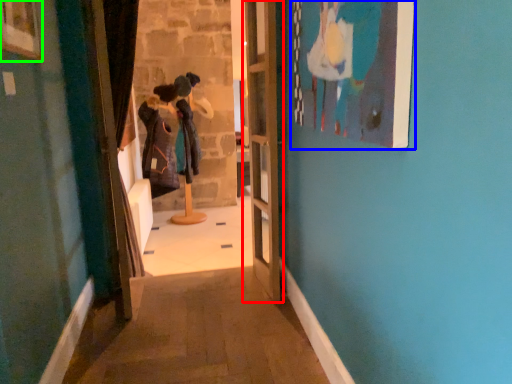
Question: Considering the real-world distances, which object is farthest from door (highlighted by a red box)? picture frame (highlighted by a blue box) or picture frame (highlighted by a green box)?

Choices:
 (A) picture frame
 (B) picture frame

Answer: (B)